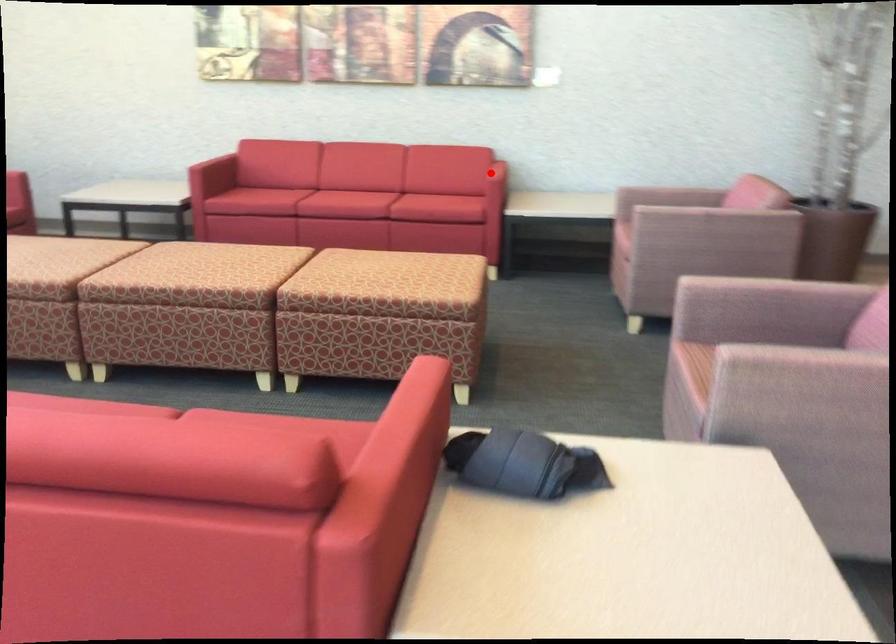
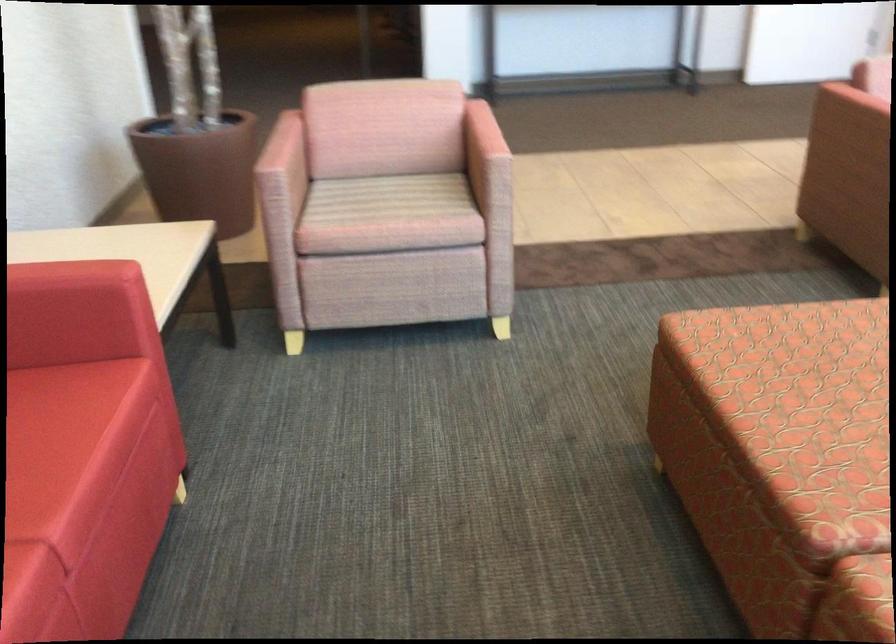
Locate, in the second image, the point that corresponds to the highlighted location in the first image.

(156, 303)